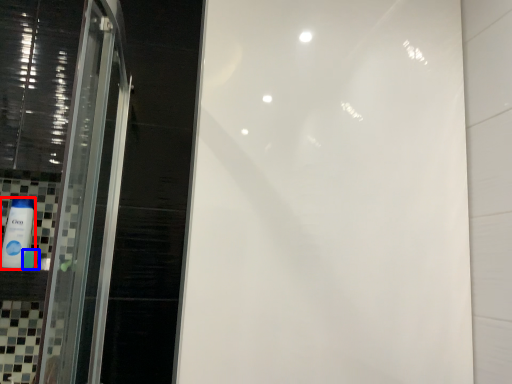
Question: Which object is closer to the camera taking this photo, mouthwash (highlighted by a red box) or toiletry (highlighted by a blue box)?

Choices:
 (A) mouthwash
 (B) toiletry

Answer: (A)